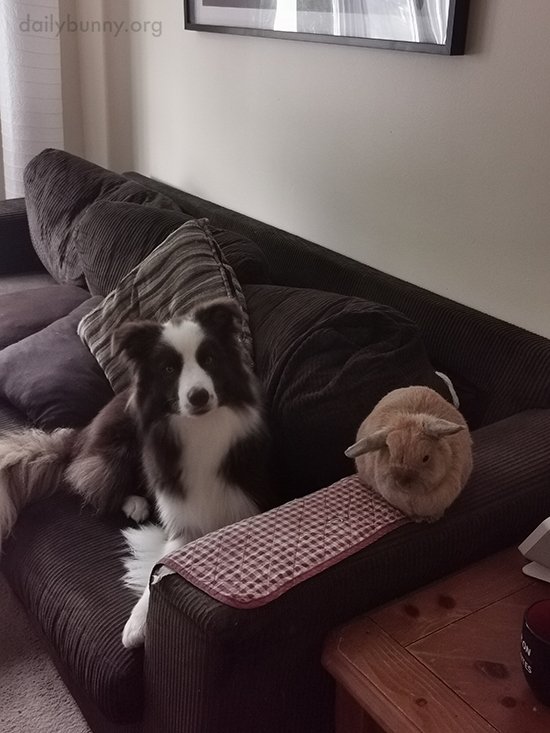
This screenshot has height=733, width=550. What are the coordinates of `cushion` in the screenshot? It's located at (168, 276), (56, 347), (33, 306), (125, 239), (306, 335), (75, 191).